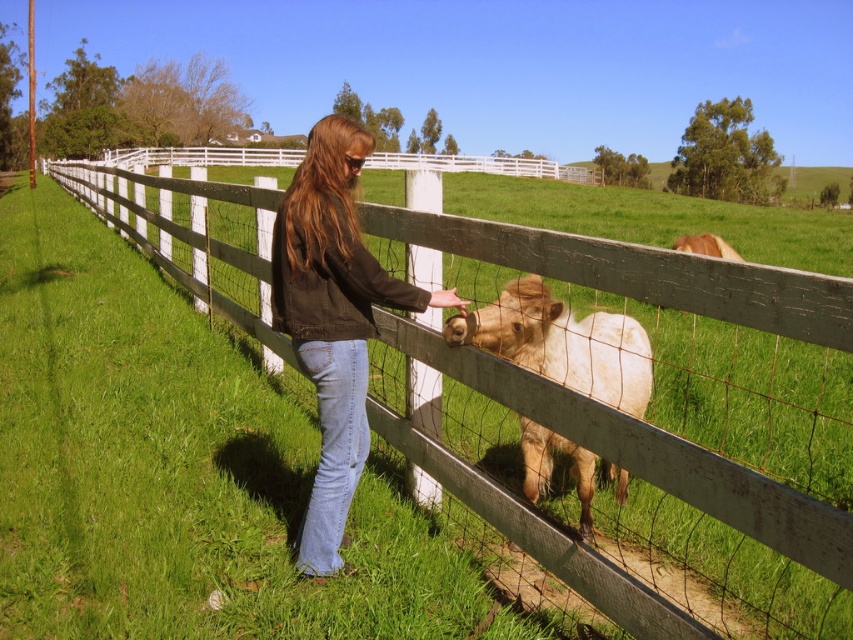
You are a photographer trying to capture a clear shot of the denim jacket at center without the white wooden fence at center blocking it. Based on their positions, is this possible?

The white wooden fence at center is positioned over the denim jacket at center, so it would block the view. To capture the denim jacket at center clearly, you need to adjust your angle to avoid the fence.

The person and the small horse are separated by the white wooden fence at center. How far apart are they from each other?

The person and the small horse are 1.28 meters apart from each other.

You are standing at the point marked by the coordinates (639, 432) in the image. What object are you touching?

The point marked by the coordinates (639, 432) is on the white wooden fence at center, so you are touching the white wooden fence at center.